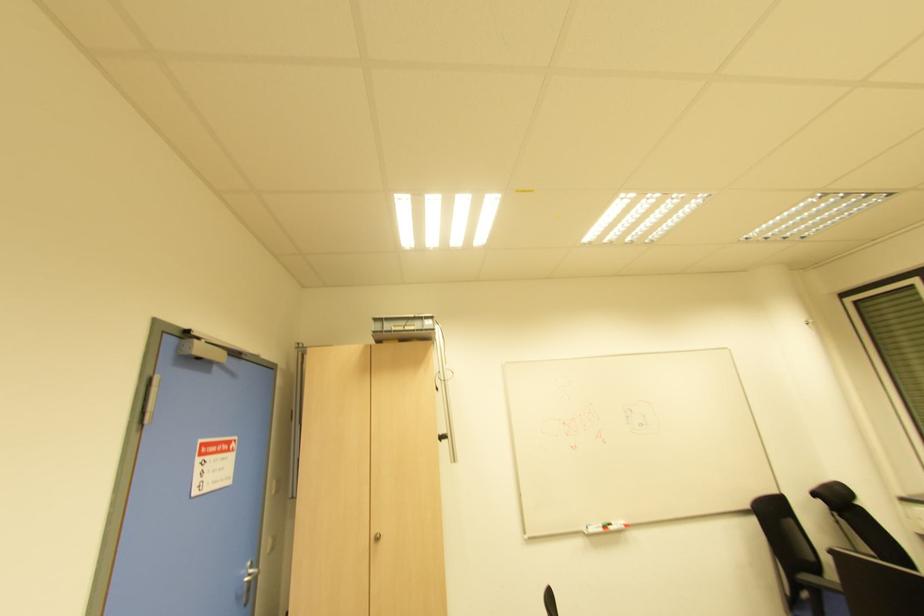
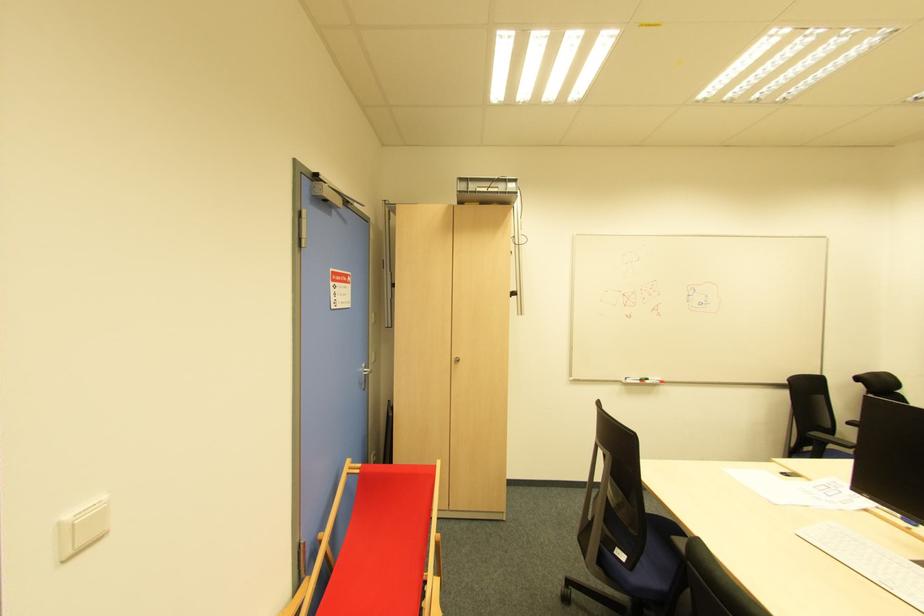
Where in the second image is the point corresponding to point (626, 525) from the first image?

(662, 383)